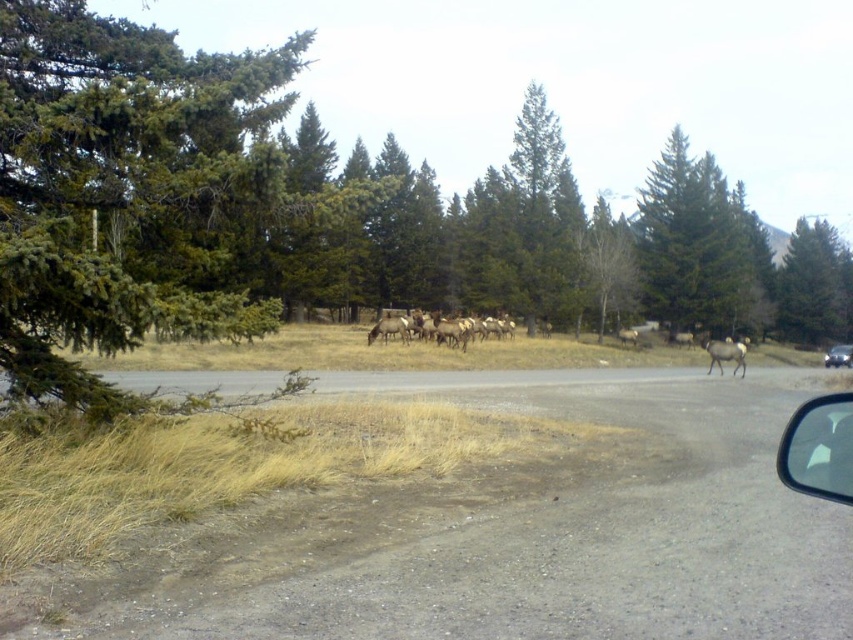
Does green textured tree at upper left appear over transparent plastic mirror at lower right?

Indeed, green textured tree at upper left is positioned over transparent plastic mirror at lower right.

From the picture: Is green textured tree at upper left to the left of transparent plastic mirror at lower right from the viewer's perspective?

Indeed, green textured tree at upper left is positioned on the left side of transparent plastic mirror at lower right.

Looking at this image, who is more forward, (544, 186) or (810, 460)?

Point (810, 460) is in front.

Locate an element on the screen. The width and height of the screenshot is (853, 640). green textured tree at upper left is located at coordinates (300, 211).

Which is in front, point (840, 337) or point (776, 467)?

Point (776, 467)

Which is more to the left, green matte tree at upper right or transparent plastic mirror at lower right?

transparent plastic mirror at lower right

Measure the distance between green matte tree at upper right and camera.

The distance of green matte tree at upper right from camera is 74.00 meters.

Locate an element on the screen. The height and width of the screenshot is (640, 853). green matte tree at upper right is located at coordinates (814, 285).

Who is positioned more to the left, green textured tree at upper left or green matte tree at upper center?

From the viewer's perspective, green textured tree at upper left appears more on the left side.

Between point (131, 58) and point (668, 204), which one is positioned behind?

The point (668, 204) is behind.

Is point (392, 176) closer to camera compared to point (755, 237)?

Yes, it is.

Locate an element on the screen. The height and width of the screenshot is (640, 853). green textured tree at upper left is located at coordinates (300, 211).